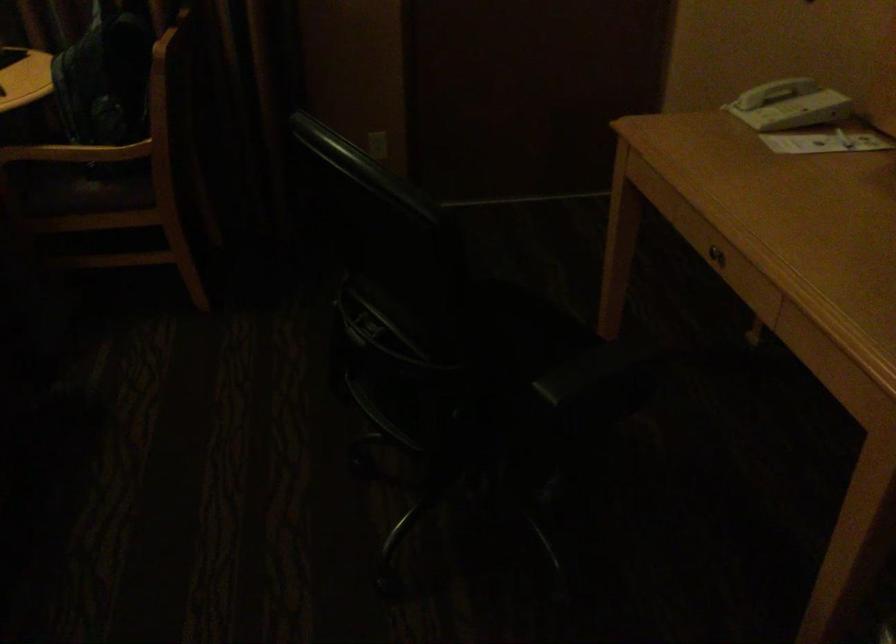
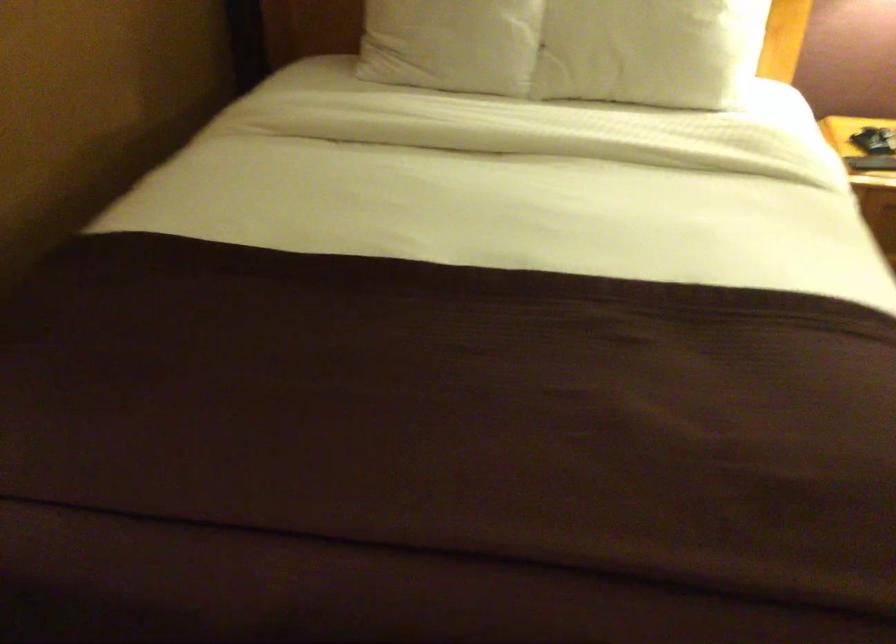
How did the camera likely rotate?

The camera's rotation is toward left-down.